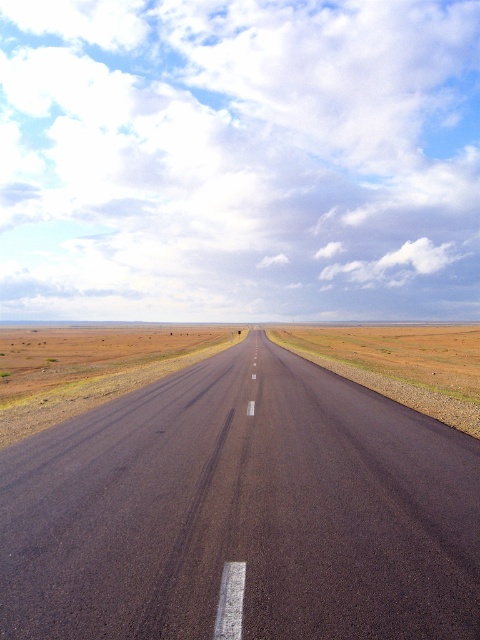
You are standing at the edge of the road and looking straight ahead. Which object, the black asphalt highway at center or the brown dirt at center, appears nearer to you?

The black asphalt highway at center appears nearer to you because it is closer to the viewer than the brown dirt at center.

You are standing on the side of the road and want to cross the black asphalt highway at center. The safe distance to wait before crossing is 12 feet. Is the highway close enough for you to cross safely?

The black asphalt highway at center is 11.80 feet from viewer, which is less than the required 12 feet safety distance. Therefore, it is not safe to cross yet.

You are a driver who needs to know the distance between the black asphalt highway at center and the brown dirt at center. Can you determine which one is longer in length?

The black asphalt highway at center is shorter than brown dirt at center, so the brown dirt at center is longer.